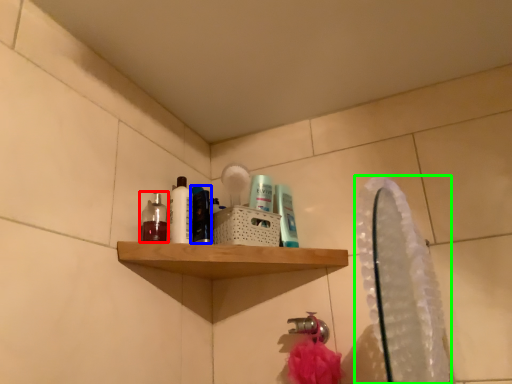
Question: Which is farther away from mouthwash (highlighted by a red box)? mouthwash (highlighted by a blue box) or mirror (highlighted by a green box)?

Choices:
 (A) mouthwash
 (B) mirror

Answer: (B)